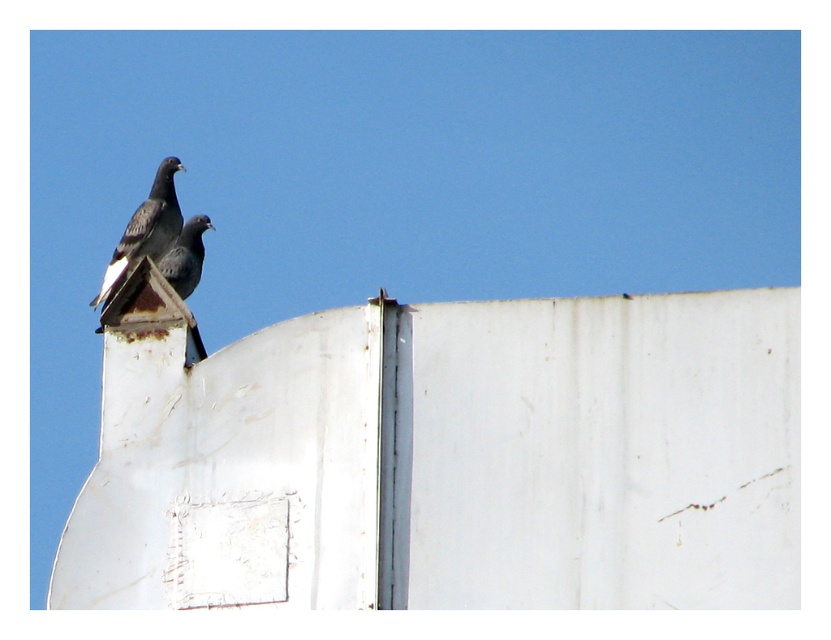
Is dark gray matte pigeon at upper left bigger than matte black pigeon at center?

Indeed, dark gray matte pigeon at upper left has a larger size compared to matte black pigeon at center.

What do you see at coordinates (145, 230) in the screenshot?
I see `dark gray matte pigeon at upper left` at bounding box center [145, 230].

Which is in front, point (140, 234) or point (176, 269)?

Point (176, 269) is more forward.

Where is `dark gray matte pigeon at upper left`? This screenshot has height=640, width=831. dark gray matte pigeon at upper left is located at coordinates (145, 230).